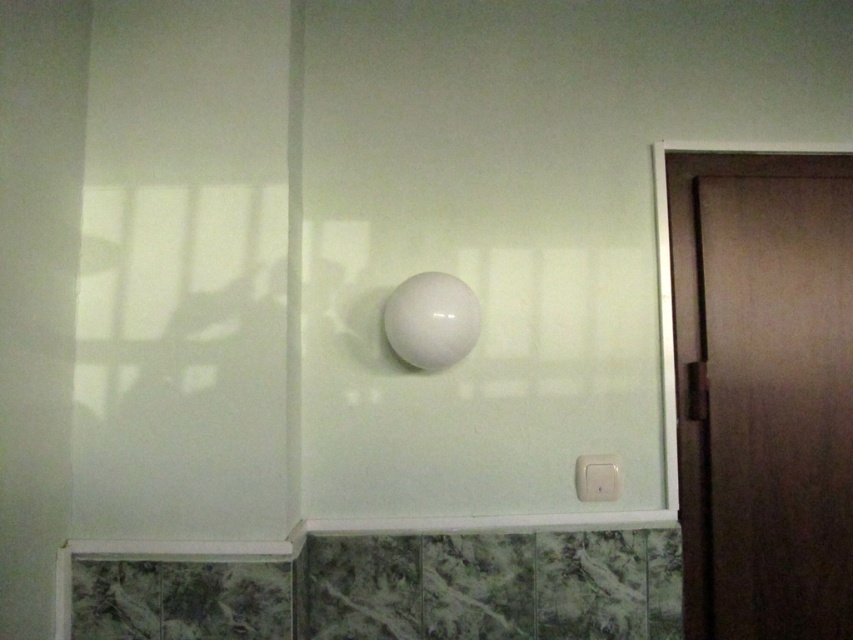
Is brown matte door at right below white plastic light switch at lower right?

Incorrect, brown matte door at right is not positioned below white plastic light switch at lower right.

From the picture: Does brown matte door at right have a smaller size compared to white plastic light switch at lower right?

Actually, brown matte door at right might be larger than white plastic light switch at lower right.

Who is more distant from viewer, (724, 164) or (605, 497)?

Positioned behind is point (724, 164).

Identify the location of brown matte door at right. (762, 388).